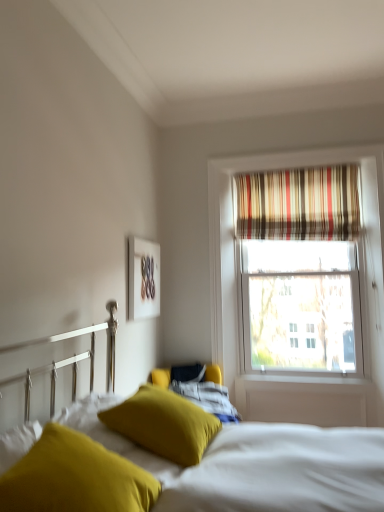
Question: Is mustard yellow fabric pillow at lower left, acting as the first pillow starting from the front, aimed at white matte picture frame at upper center?

Choices:
 (A) yes
 (B) no

Answer: (B)

Question: Is mustard yellow fabric pillow at lower left, placed as the second pillow when sorted from back to front, taller than white matte picture frame at upper center?

Choices:
 (A) yes
 (B) no

Answer: (B)

Question: Are mustard yellow fabric pillow at lower left, acting as the first pillow starting from the front, and white matte picture frame at upper center far apart?

Choices:
 (A) yes
 (B) no

Answer: (A)

Question: From the image's perspective, is mustard yellow fabric pillow at lower left, placed as the second pillow when sorted from back to front, above white matte picture frame at upper center?

Choices:
 (A) yes
 (B) no

Answer: (B)

Question: Would you say mustard yellow fabric pillow at lower left, acting as the first pillow starting from the front, is outside white matte picture frame at upper center?

Choices:
 (A) yes
 (B) no

Answer: (A)

Question: Considering the relative sizes of mustard yellow fabric pillow at lower left, placed as the second pillow when sorted from back to front, and white matte picture frame at upper center in the image provided, is mustard yellow fabric pillow at lower left, placed as the second pillow when sorted from back to front, bigger than white matte picture frame at upper center?

Choices:
 (A) yes
 (B) no

Answer: (A)

Question: Is white matte picture frame at upper center surrounding striped fabric curtain at upper right?

Choices:
 (A) no
 (B) yes

Answer: (A)

Question: Can we say white matte picture frame at upper center lies outside striped fabric curtain at upper right?

Choices:
 (A) no
 (B) yes

Answer: (B)

Question: Is white matte picture frame at upper center at the left side of striped fabric curtain at upper right?

Choices:
 (A) no
 (B) yes

Answer: (B)

Question: From the image's perspective, is white matte picture frame at upper center below striped fabric curtain at upper right?

Choices:
 (A) yes
 (B) no

Answer: (A)

Question: Can you confirm if white matte picture frame at upper center is thinner than striped fabric curtain at upper right?

Choices:
 (A) yes
 (B) no

Answer: (A)

Question: From the image's perspective, does white matte picture frame at upper center appear higher than striped fabric curtain at upper right?

Choices:
 (A) no
 (B) yes

Answer: (A)

Question: From the image's perspective, would you say soft yellow pillow at lower left is shown under mustard yellow fabric pillow at lower left, placed as the second pillow when sorted from back to front?

Choices:
 (A) yes
 (B) no

Answer: (A)